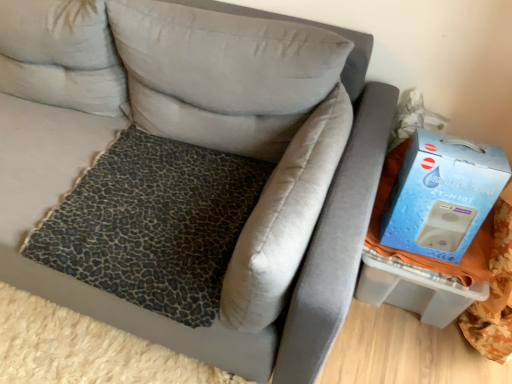
Question: Would you say leopard print fabric pillow at center, the 3th pillow when ordered from left to right, is to the left or to the right of blue cardboard box at right in the picture?

Choices:
 (A) right
 (B) left

Answer: (B)

Question: From a real-world perspective, relative to blue cardboard box at right, is leopard print fabric pillow at center, the 3th pillow when ordered from left to right, vertically above or below?

Choices:
 (A) above
 (B) below

Answer: (B)

Question: Based on their relative distances, which object is nearer to the blue cardboard box at right?

Choices:
 (A) leopard print fabric pillow at center, the 3th pillow when ordered from left to right
 (B) light gray fabric pillow at upper left, marked as the third pillow in a right-to-left arrangement
 (C) leopard print fabric at center
 (D) leopard print fabric pillow at center, arranged as the second pillow when viewed from the left

Answer: (A)

Question: Which object is the closest to the light gray fabric pillow at upper left, marked as the third pillow in a right-to-left arrangement?

Choices:
 (A) blue cardboard box at right
 (B) leopard print fabric at center
 (C) leopard print fabric pillow at center, the 3th pillow when ordered from left to right
 (D) leopard print fabric pillow at center, arranged as the second pillow when viewed from the left

Answer: (D)